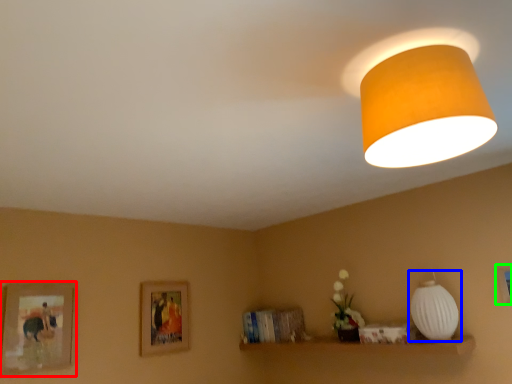
Question: Considering the real-world distances, which object is closest to picture frame (highlighted by a red box)? lamp (highlighted by a blue box) or picture frame (highlighted by a green box).

Choices:
 (A) lamp
 (B) picture frame

Answer: (A)